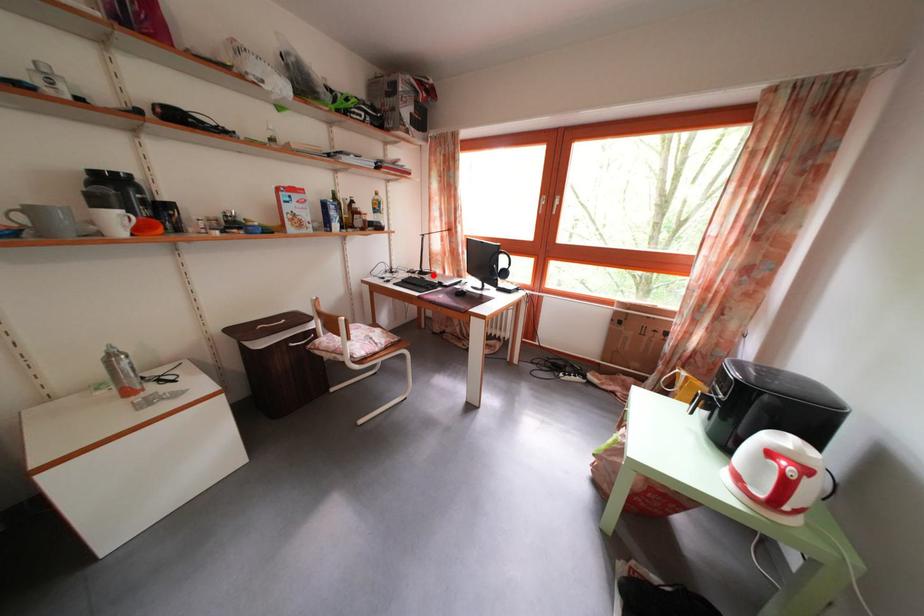
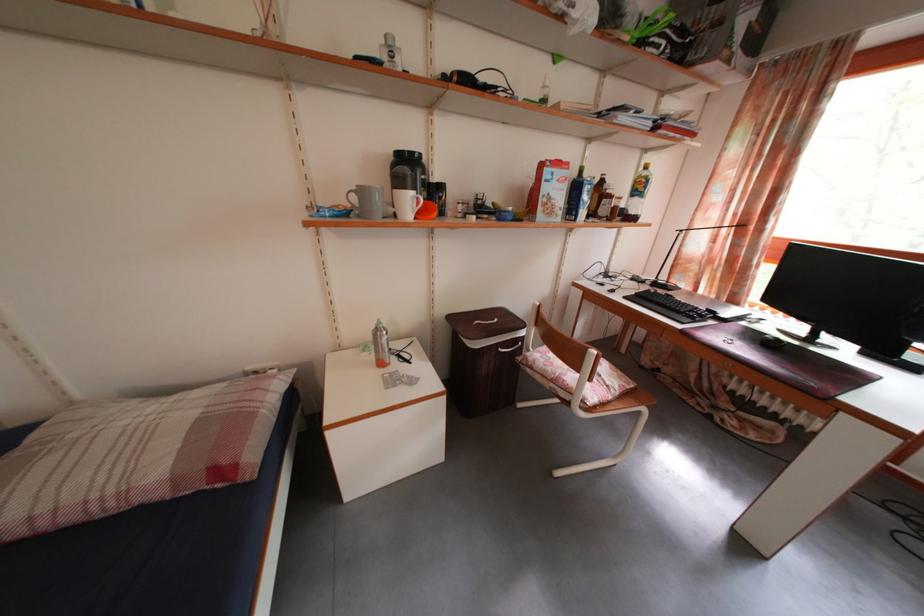
The point at the highlighted location is marked in the first image. Where is the corresponding point in the second image?

(671, 285)